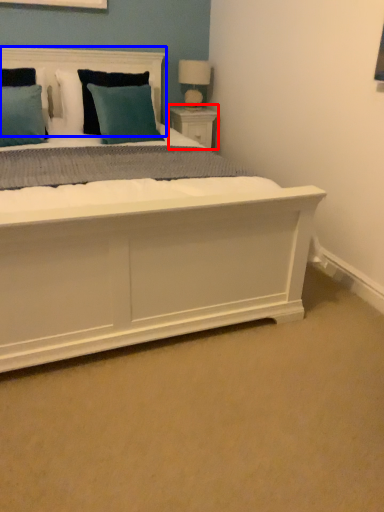
Question: Which of the following is the farthest to the observer, nightstand (highlighted by a red box) or headboard (highlighted by a blue box)?

Choices:
 (A) nightstand
 (B) headboard

Answer: (A)